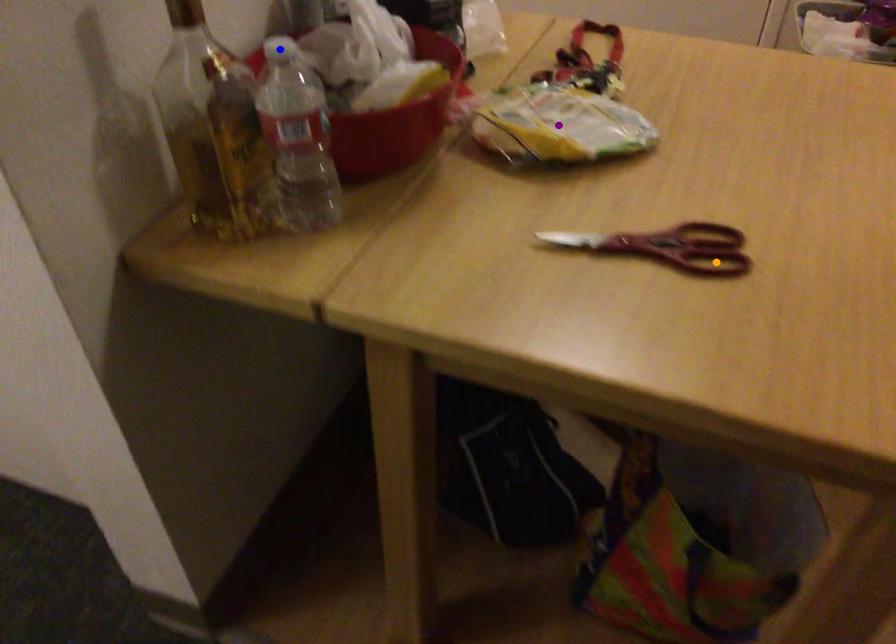
Order these from farthest to nearest:
A) blue point
B) orange point
C) purple point

1. purple point
2. orange point
3. blue point